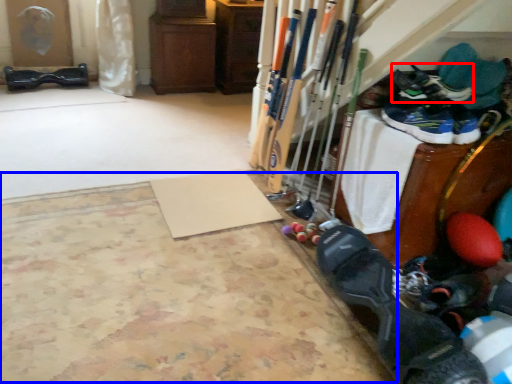
Question: Which point is further to the camera, footwear (highlighted by a red box) or yoga mat (highlighted by a blue box)?

Choices:
 (A) footwear
 (B) yoga mat

Answer: (A)